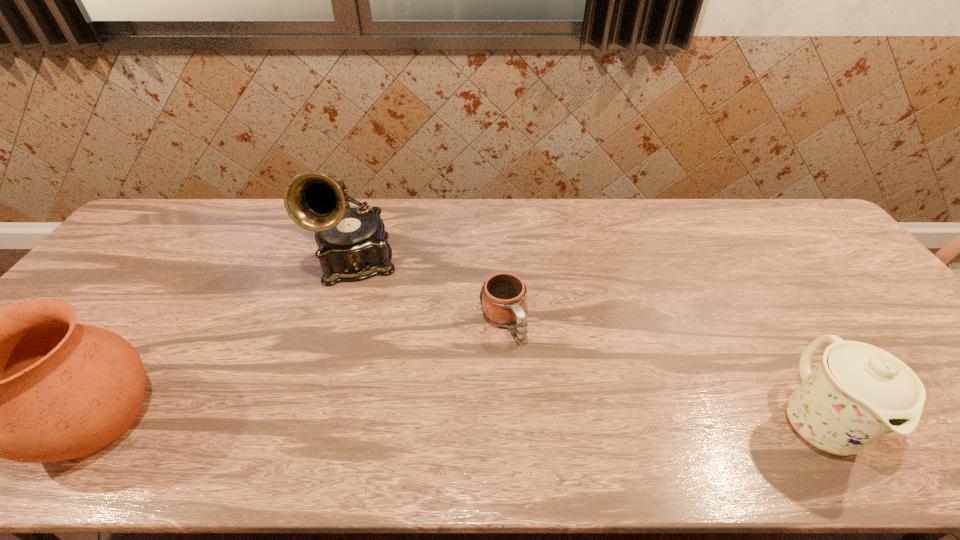
Where is `free location located 0.370m on the horn of the second object from left to right`? Image resolution: width=960 pixels, height=540 pixels. free location located 0.370m on the horn of the second object from left to right is located at coordinates (371, 409).

Where is `object located at the far edge`? This screenshot has height=540, width=960. object located at the far edge is located at coordinates (352, 245).

Find the location of a particular element. This screenshot has width=960, height=540. object that is at the near edge is located at coordinates (857, 394).

In the image, there is a desktop. Where is `vacant space at the far edge`? The image size is (960, 540). vacant space at the far edge is located at coordinates (738, 204).

Locate an element on the screen. The image size is (960, 540). vacant space at the near edge of the desktop is located at coordinates (338, 394).

Locate an element on the screen. This screenshot has height=540, width=960. free space at the right edge is located at coordinates (854, 276).

In the image, there is a desktop. Identify the location of vacant space at the far left corner. (165, 207).

The image size is (960, 540). In the image, there is a desktop. Find the location of `vacant space at the far right corner`. vacant space at the far right corner is located at coordinates (772, 211).

Identify the location of free area in between the rightmost object and the farthest object. (586, 341).

Find the location of `free area in between the mug and the phonograph record`. free area in between the mug and the phonograph record is located at coordinates (429, 292).